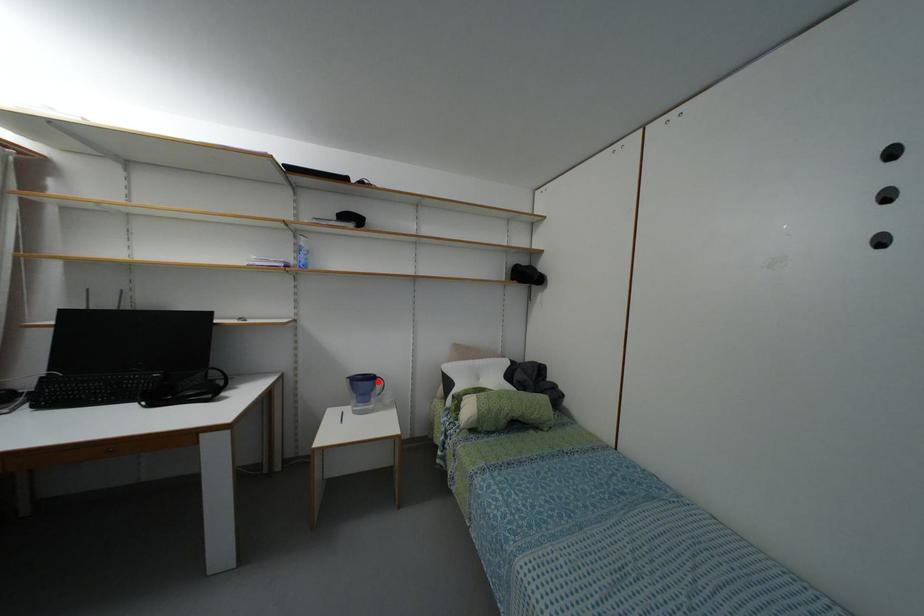
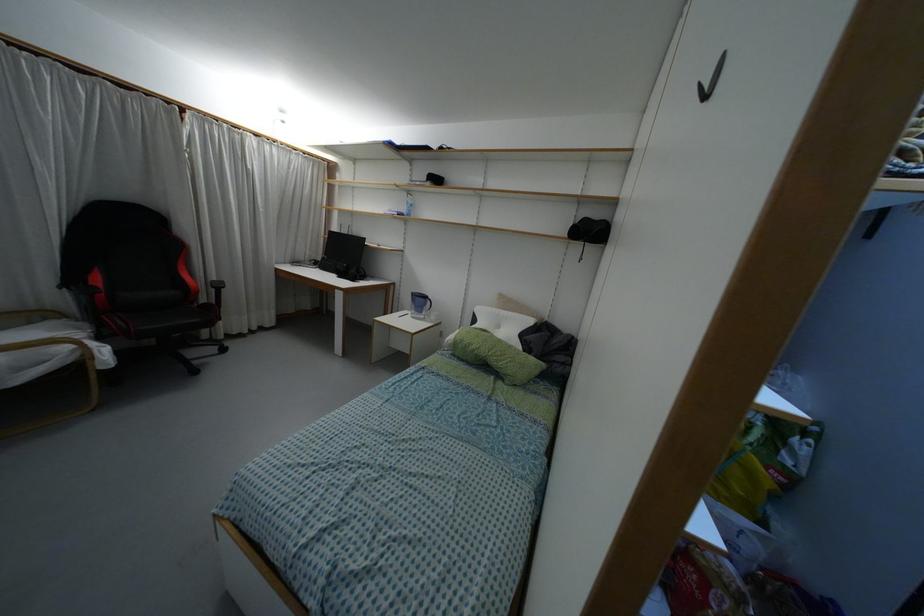
In the second image, find the point that corresponds to the highlighted location in the first image.

(428, 302)